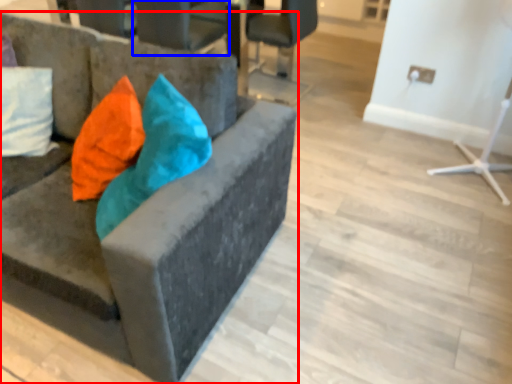
Question: Which point is closer to the camera, chair (highlighted by a red box) or chair (highlighted by a blue box)?

Choices:
 (A) chair
 (B) chair

Answer: (A)